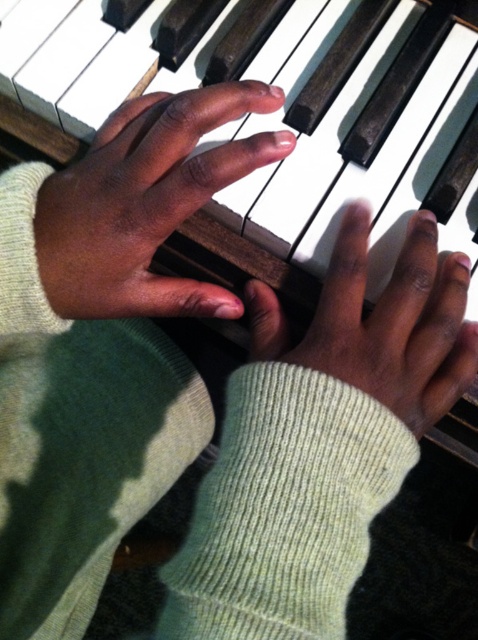
Question: Which of the following is the closest to the observer?

Choices:
 (A) (420, 321)
 (B) (84, 272)

Answer: (B)

Question: Is dark skin hand at upper center below smooth skin hand at center?

Choices:
 (A) no
 (B) yes

Answer: (A)

Question: Can you confirm if dark skin hand at upper center is positioned below smooth skin hand at center?

Choices:
 (A) no
 (B) yes

Answer: (A)

Question: Which of the following is the closest to the observer?

Choices:
 (A) dark skin hand at upper center
 (B) smooth skin hand at center

Answer: (B)

Question: Is dark skin hand at upper center further to camera compared to smooth skin hand at center?

Choices:
 (A) no
 (B) yes

Answer: (B)